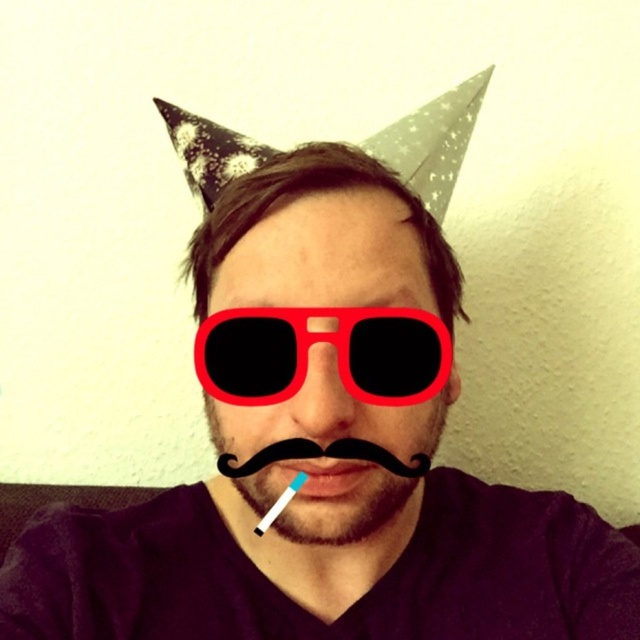
Question: Considering the real-world distances, which object is closest to the matte plastic toothbrush at center?

Choices:
 (A) black fuzzy beard at center
 (B) red plastic sunglasses at center

Answer: (A)

Question: Which object is the farthest from the red plastic sunglasses at center?

Choices:
 (A) matte plastic toothbrush at center
 (B) black fuzzy beard at center

Answer: (A)

Question: Estimate the real-world distances between objects in this image. Which object is farther from the black fuzzy beard at center?

Choices:
 (A) red plastic sunglasses at center
 (B) matte plastic toothbrush at center

Answer: (A)

Question: Can you confirm if red plastic sunglasses at center is wider than matte plastic toothbrush at center?

Choices:
 (A) yes
 (B) no

Answer: (A)

Question: Observing the image, what is the correct spatial positioning of red plastic sunglasses at center in reference to black fuzzy beard at center?

Choices:
 (A) right
 (B) left

Answer: (B)

Question: Does red plastic sunglasses at center come behind matte plastic toothbrush at center?

Choices:
 (A) no
 (B) yes

Answer: (A)